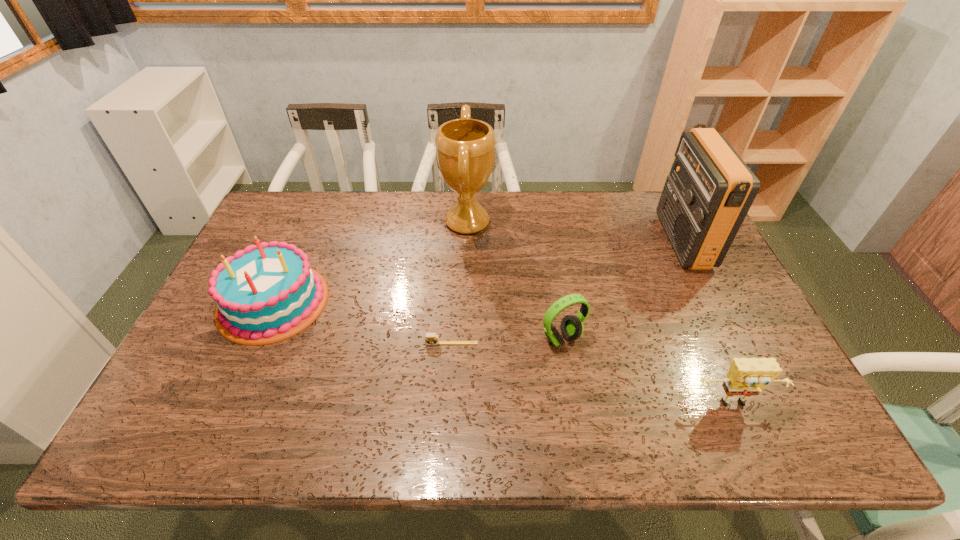
Identify the location of object located at the far right corner. The height and width of the screenshot is (540, 960). (710, 189).

You are a GUI agent. You are given a task and a screenshot of the screen. Output one action in this format:
    pyautogui.click(x=<x>, y=<y>)
    Task: Click on the object positioned at the near right corner
    The width and height of the screenshot is (960, 540).
    Given the screenshot: What is the action you would take?
    pyautogui.click(x=747, y=376)

Where is `free space at the far edge of the desktop`? Image resolution: width=960 pixels, height=540 pixels. free space at the far edge of the desktop is located at coordinates (616, 192).

In the image, there is a desktop. At what (x,y) coordinates should I click in order to perform the action: click on blank space at the near edge. Please return your answer as a coordinate pair (x, y). The width and height of the screenshot is (960, 540). Looking at the image, I should click on (708, 422).

Locate an element on the screen. The width and height of the screenshot is (960, 540). vacant space at the left edge is located at coordinates (176, 401).

Find the location of `vacant space at the right edge of the desktop`. vacant space at the right edge of the desktop is located at coordinates (700, 272).

This screenshot has width=960, height=540. Find the location of `vacant space at the far left corner of the desktop`. vacant space at the far left corner of the desktop is located at coordinates (305, 192).

Identify the location of free space between the radio receiver and the award. The height and width of the screenshot is (540, 960). (575, 232).

This screenshot has height=540, width=960. Identify the location of unoccupied position between the shortest object and the award. (460, 282).

At what (x,y) coordinates should I click in order to perform the action: click on free space between the leftmost object and the shortest object. Please return your answer as a coordinate pair (x, y). The width and height of the screenshot is (960, 540). Looking at the image, I should click on (363, 322).